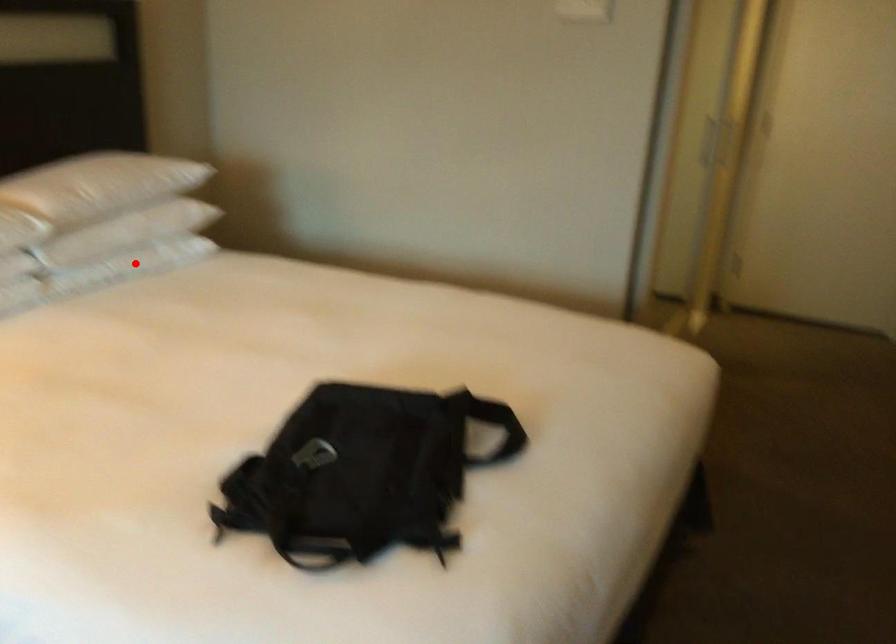
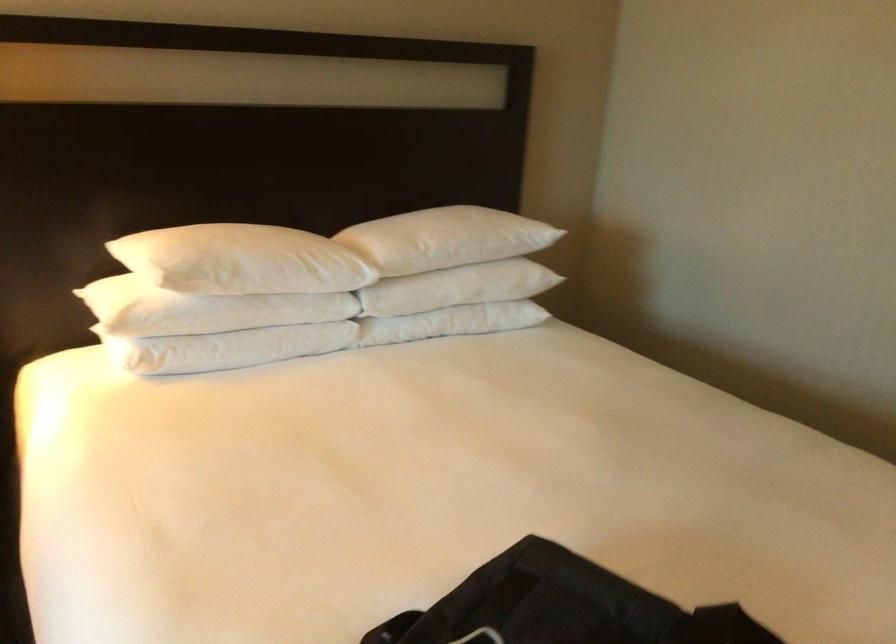
Where in the second image is the point corresponding to the highlighted location from the first image?

(451, 322)